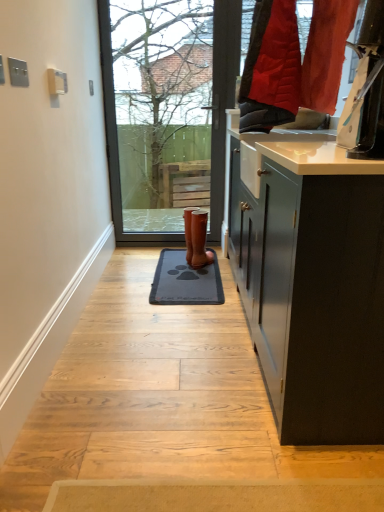
Question: Is point (198, 261) closer or farther from the camera than point (188, 23)?

Choices:
 (A) closer
 (B) farther

Answer: (A)

Question: Visually, is brown leather boot at center positioned to the left or to the right of bare branches at upper center?

Choices:
 (A) left
 (B) right

Answer: (B)

Question: Considering the real-world distances, which object is farthest from the bare branches at upper center?

Choices:
 (A) dark gray rubber doormat at center
 (B) brown leather boot at center

Answer: (A)

Question: Estimate the real-world distances between objects in this image. Which object is closer to the dark gray rubber doormat at center?

Choices:
 (A) bare branches at upper center
 (B) brown leather boot at center

Answer: (B)